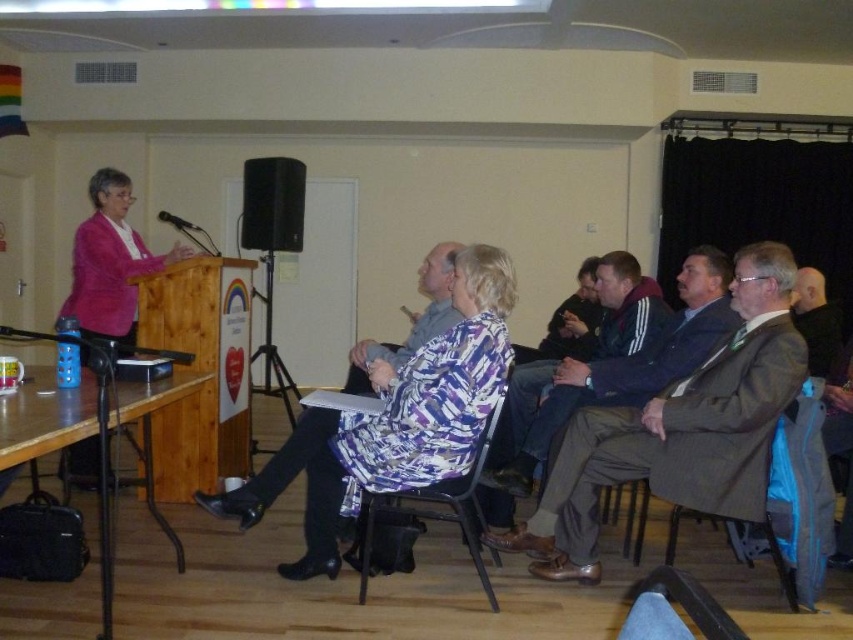
Question: Which point is farther to the camera?

Choices:
 (A) (361, 561)
 (B) (819, 554)

Answer: (A)

Question: Which of the following is the closest to the observer?

Choices:
 (A) [820, 545]
 (B) [479, 250]
 (C) [117, 257]
 (D) [126, 385]

Answer: (B)

Question: Observing the image, what is the correct spatial positioning of wooden table at lower left in reference to brown fabric chair at lower right?

Choices:
 (A) below
 (B) above

Answer: (B)

Question: Can you confirm if brown woolen suit at center is wider than pink fabric jacket at left?

Choices:
 (A) yes
 (B) no

Answer: (A)

Question: Is brown woolen suit at center to the left of dark blue jacket at center from the viewer's perspective?

Choices:
 (A) no
 (B) yes

Answer: (A)

Question: Which point is farther from the camera taking this photo?

Choices:
 (A) click(x=137, y=385)
 (B) click(x=793, y=528)
 (C) click(x=93, y=312)
 (D) click(x=456, y=486)

Answer: (C)